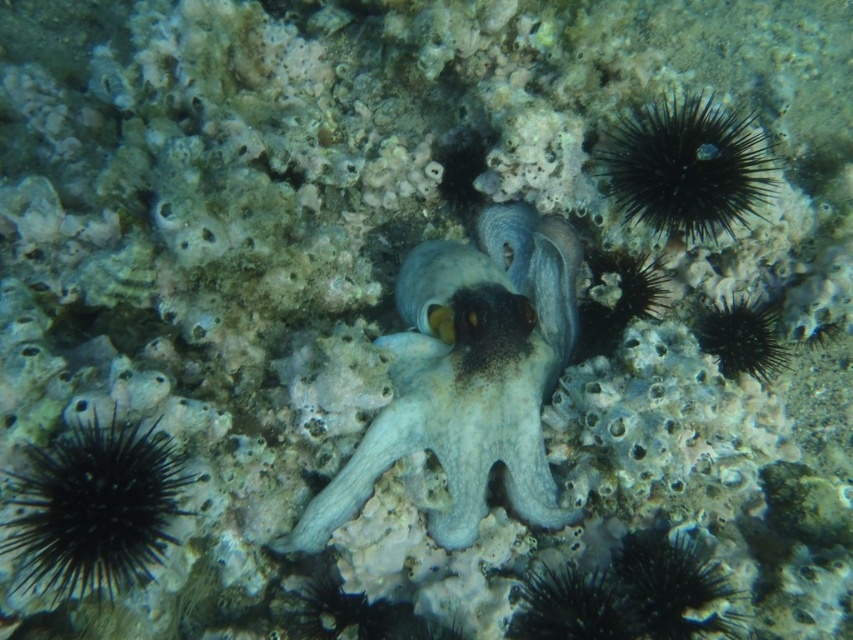
Question: Which object is the closest to the black spiny sea urchin at upper right?

Choices:
 (A) gray matte octopus at center
 (B) black spiny sea urchin at lower left

Answer: (A)

Question: Considering the relative positions of black spiny sea urchin at lower left and black spiny sea urchin at upper right in the image provided, where is black spiny sea urchin at lower left located with respect to black spiny sea urchin at upper right?

Choices:
 (A) below
 (B) above

Answer: (A)

Question: Does gray matte octopus at center come behind black spiny sea urchin at lower left?

Choices:
 (A) no
 (B) yes

Answer: (B)

Question: Which object appears farthest from the camera in this image?

Choices:
 (A) black spiny sea urchin at upper right
 (B) gray matte octopus at center
 (C) black spiny sea urchin at lower left

Answer: (B)

Question: Does gray matte octopus at center appear on the left side of black spiny sea urchin at upper right?

Choices:
 (A) no
 (B) yes

Answer: (B)

Question: Which of these objects is positioned farthest from the gray matte octopus at center?

Choices:
 (A) black spiny sea urchin at lower left
 (B) black spiny sea urchin at upper right

Answer: (A)